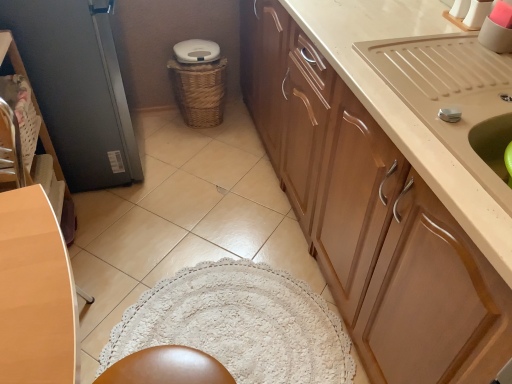
At what (x,y) coordinates should I click in order to perform the action: click on vacant area that is situated to the right of matte brown chair at left. Please return your answer as a coordinate pair (x, y). The image size is (512, 384). Looking at the image, I should click on 160,324.